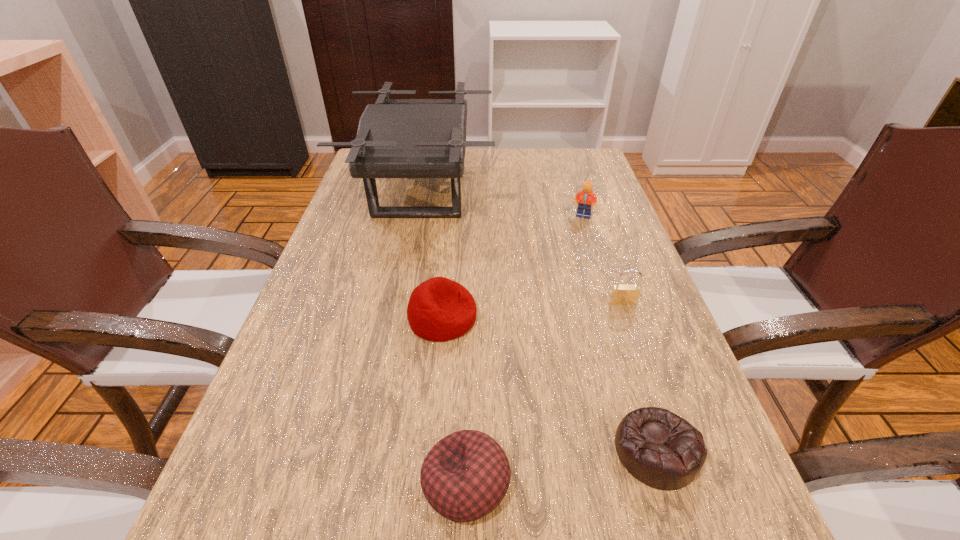
Locate an element on the screen. This screenshot has width=960, height=540. blank area in the image that satisfies the following two spatial constraints: 1. with a camera mounted on the underside of the rightmost beanbag; 2. on the left side of the tallest object is located at coordinates (372, 451).

In order to click on vacant position in the image that satisfies the following two spatial constraints: 1. on the front-facing side of the Lego; 2. on the seat area of the farthest beanbag in this screenshot , I will do `click(615, 318)`.

Image resolution: width=960 pixels, height=540 pixels. I want to click on free space that satisfies the following two spatial constraints: 1. on the front-facing side of the Lego; 2. on the seat area of the farthest beanbag, so click(x=615, y=318).